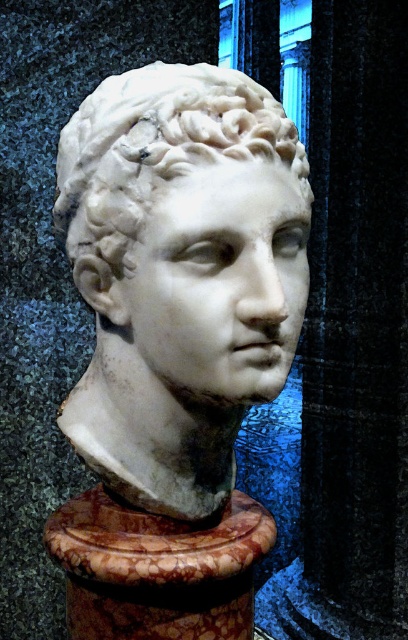
Question: Can you confirm if white marble bust at center is positioned below marble pedestal at center?

Choices:
 (A) no
 (B) yes

Answer: (A)

Question: Can you confirm if white marble bust at center is positioned to the right of marble pedestal at center?

Choices:
 (A) no
 (B) yes

Answer: (A)

Question: Can you confirm if white marble bust at center is bigger than marble pedestal at center?

Choices:
 (A) yes
 (B) no

Answer: (A)

Question: Which point is closer to the camera?

Choices:
 (A) (184, 628)
 (B) (117, 192)

Answer: (B)

Question: Among these objects, which one is nearest to the camera?

Choices:
 (A) white marble bust at center
 (B) marble pedestal at center

Answer: (A)